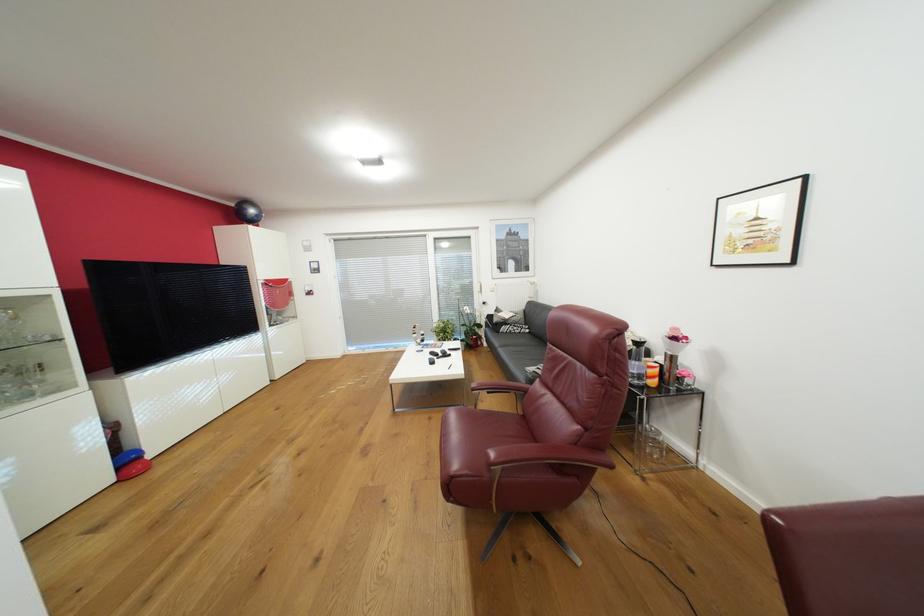
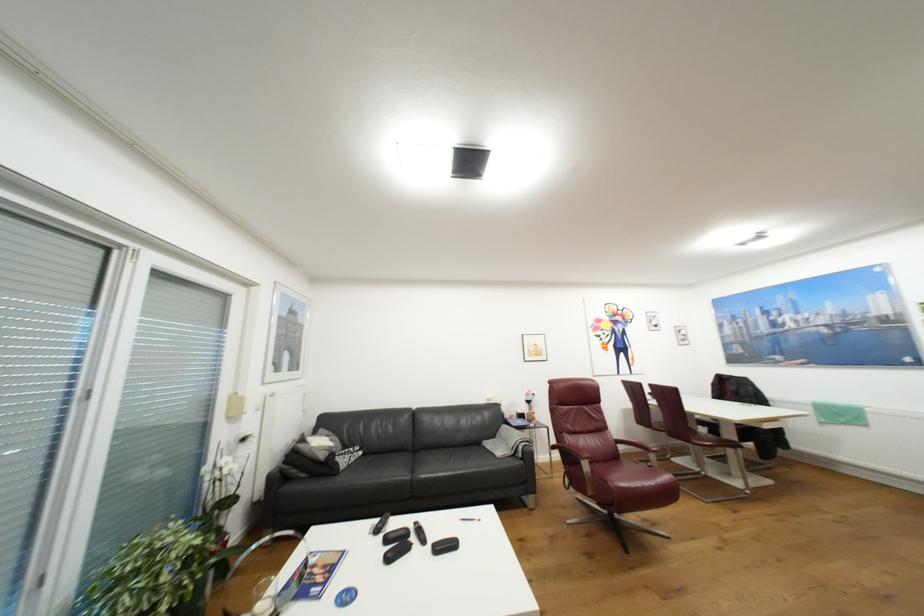
The point at (505, 310) is marked in the first image. Where is the corresponding point in the second image?

(309, 440)